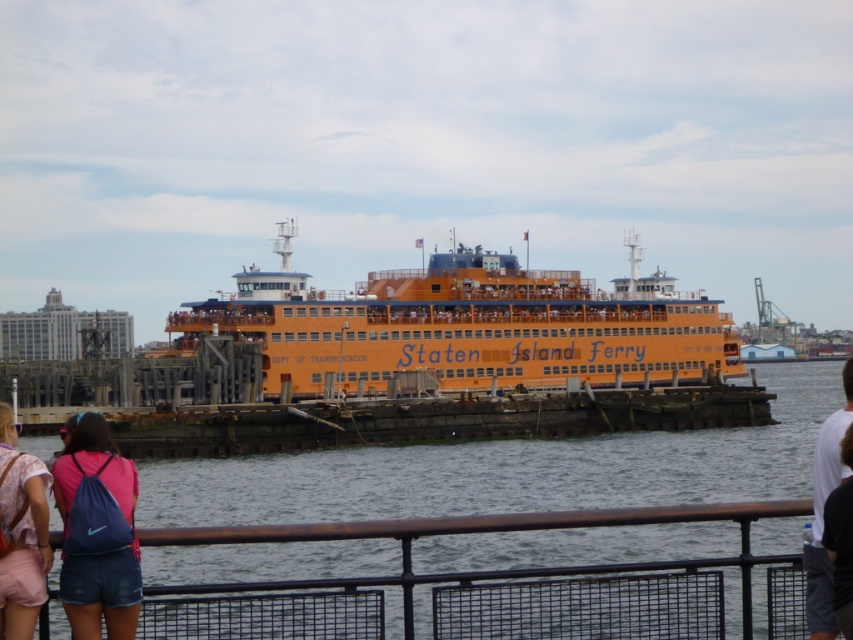
You are a photographer trying to capture a photo of the orange matte staten island ferry at center and the white cotton shirt at lower right. Which object should you focus on first if you want to ensure both are in the frame without moving the camera?

You should focus on the orange matte staten island ferry at center first because it is taller than the white cotton shirt at lower right, so adjusting the camera angle to include its height will naturally include the shorter shirt in the frame.

You are standing on a pier looking at the Staten Island Ferry. You notice a pink fabric backpack at lower left and clear water at center. Which object is positioned lower in the scene?

The clear water at center is positioned below the pink fabric backpack at lower left, meaning the clear water at center is lower in the scene.

You are standing at the point marked as point (508,468) in the image. What do you see directly in front of you?

You see clear water at center directly in front of you at point (508,468).